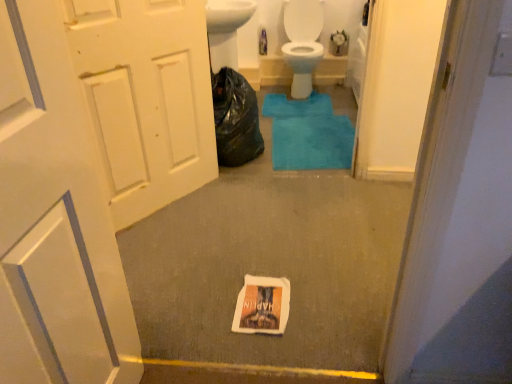
The image size is (512, 384). Identify the location of vacant space in teal plush bath mat at center (from a real-world perspective). (320, 134).